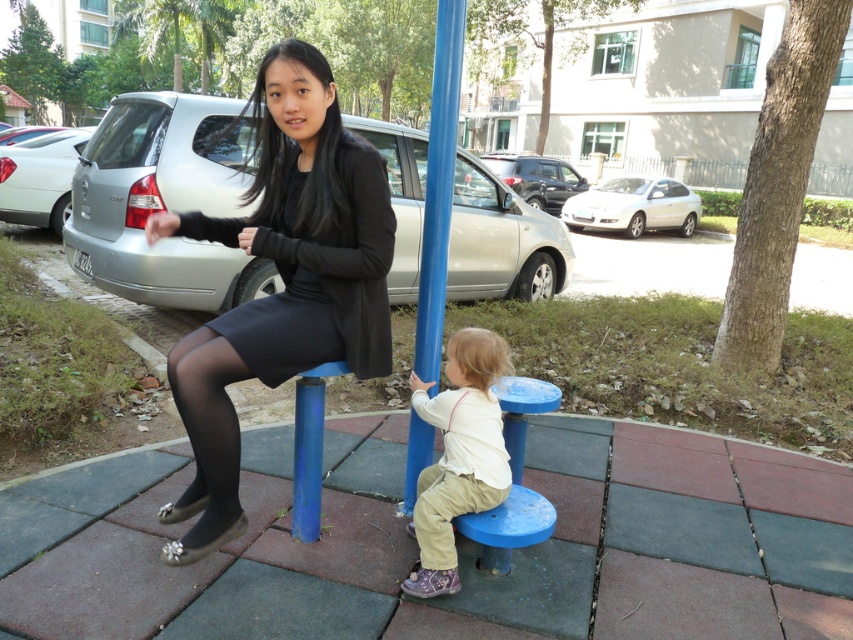
Question: Which point is closer to the camera taking this photo?

Choices:
 (A) (424, 312)
 (B) (495, 420)
 (C) (325, 269)

Answer: (C)

Question: Is matte black dress at center closer to camera compared to light beige cotton pants at lower center?

Choices:
 (A) yes
 (B) no

Answer: (A)

Question: Does matte black dress at center appear on the left side of blue plastic pole at center?

Choices:
 (A) yes
 (B) no

Answer: (A)

Question: Which of these objects is positioned closest to the light beige cotton pants at lower center?

Choices:
 (A) blue plastic pole at center
 (B) matte black dress at center
 (C) black matte dress at center

Answer: (A)

Question: Which object is the closest to the blue plastic pole at center?

Choices:
 (A) light beige cotton pants at lower center
 (B) matte black dress at center

Answer: (A)

Question: Is black matte dress at center smaller than blue plastic pole at center?

Choices:
 (A) no
 (B) yes

Answer: (B)